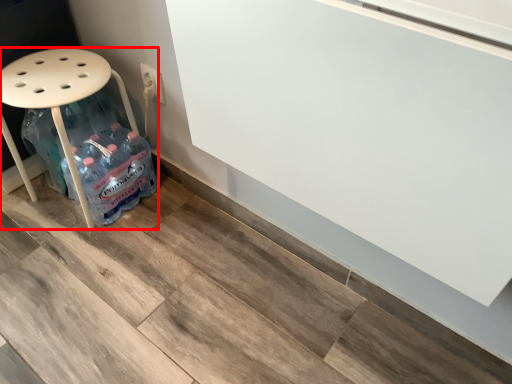
Question: Where is furniture (annotated by the red box) located in relation to electric outlet in the image?

Choices:
 (A) right
 (B) left

Answer: (B)